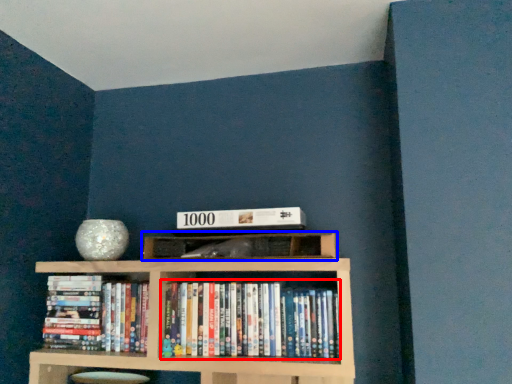
Question: Which object appears closest to the camera in this image, book (highlighted by a red box) or shelf (highlighted by a blue box)?

Choices:
 (A) book
 (B) shelf

Answer: (B)